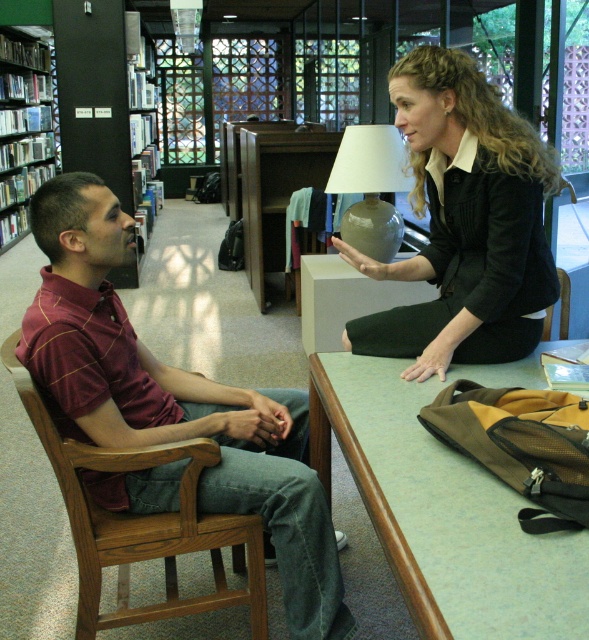
You are an interior designer planning to replace the maroon striped shirt at left and the green laminate table at center with new items. If you want to maintain the current size relationship between them, which item should you choose to be larger?

The maroon striped shirt at left should be larger than the green laminate table at center to maintain the size relationship.

You are standing at the point labeled point (72,339) and want to walk to the point labeled point (372,253). Which direction should you face to walk directly towards your destination?

You should face backward because point (72,339) is in front of point (372,253), so to reach point (372,253) you need to walk in the opposite direction.